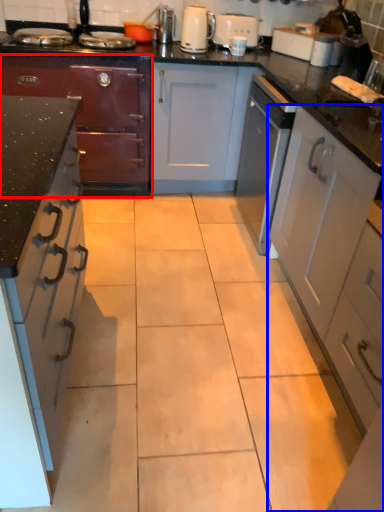
Question: Which object is closer to the camera taking this photo, cabinetry (highlighted by a red box) or cabinetry (highlighted by a blue box)?

Choices:
 (A) cabinetry
 (B) cabinetry

Answer: (B)